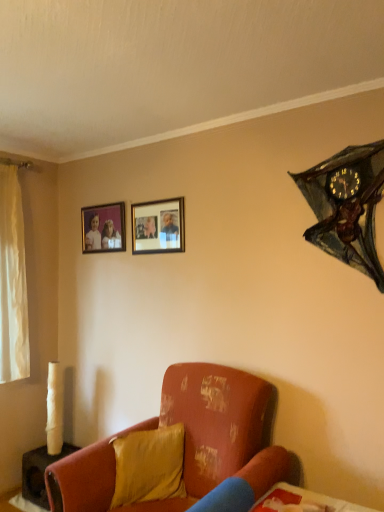
Question: From the image's perspective, does satin yellow pillow at lower center appear higher than matte wooden picture frame at upper left, the second picture frame positioned from the front?

Choices:
 (A) yes
 (B) no

Answer: (B)

Question: From the image's perspective, is satin yellow pillow at lower center under matte wooden picture frame at upper left, positioned as the 1th picture frame in left-to-right order?

Choices:
 (A) no
 (B) yes

Answer: (B)

Question: Is satin yellow pillow at lower center located outside matte wooden picture frame at upper left, which appears as the first picture frame when viewed from the back?

Choices:
 (A) yes
 (B) no

Answer: (A)

Question: Considering the relative positions of satin yellow pillow at lower center and matte wooden picture frame at upper left, which appears as the first picture frame when viewed from the back, in the image provided, is satin yellow pillow at lower center in front of matte wooden picture frame at upper left, which appears as the first picture frame when viewed from the back,?

Choices:
 (A) yes
 (B) no

Answer: (A)

Question: Is satin yellow pillow at lower center facing towards matte wooden picture frame at upper left, which appears as the first picture frame when viewed from the back?

Choices:
 (A) no
 (B) yes

Answer: (A)

Question: From a real-world perspective, is matte wooden picture frame at upper left, positioned as the 1th picture frame in left-to-right order, above or below metallic bat-shaped clock at upper right?

Choices:
 (A) below
 (B) above

Answer: (B)

Question: Is matte wooden picture frame at upper left, which appears as the first picture frame when viewed from the back, wider or thinner than metallic bat-shaped clock at upper right?

Choices:
 (A) thin
 (B) wide

Answer: (A)

Question: Is matte wooden picture frame at upper left, which is the second picture frame from right to left, taller or shorter than metallic bat-shaped clock at upper right?

Choices:
 (A) tall
 (B) short

Answer: (B)

Question: Do you think matte wooden picture frame at upper left, which appears as the first picture frame when viewed from the back, is within metallic bat-shaped clock at upper right, or outside of it?

Choices:
 (A) inside
 (B) outside

Answer: (B)

Question: Is point (339, 245) positioned closer to the camera than point (81, 222)?

Choices:
 (A) farther
 (B) closer

Answer: (B)

Question: Choose the correct answer: Is metallic bat-shaped clock at upper right inside matte wooden picture frame at upper left, which appears as the first picture frame when viewed from the back, or outside it?

Choices:
 (A) inside
 (B) outside

Answer: (B)

Question: From the image's perspective, is metallic bat-shaped clock at upper right positioned above or below matte wooden picture frame at upper left, which is the second picture frame from right to left?

Choices:
 (A) below
 (B) above

Answer: (A)

Question: In terms of size, does metallic bat-shaped clock at upper right appear bigger or smaller than matte wooden picture frame at upper left, which appears as the first picture frame when viewed from the back?

Choices:
 (A) small
 (B) big

Answer: (B)

Question: Considering the positions of matte wooden picture frame at upper left, the second picture frame positioned from the front, and matte black picture frame at upper center, the first picture frame when ordered from right to left, in the image, is matte wooden picture frame at upper left, the second picture frame positioned from the front, taller or shorter than matte black picture frame at upper center, the first picture frame when ordered from right to left,?

Choices:
 (A) tall
 (B) short

Answer: (B)

Question: Looking at their shapes, would you say matte wooden picture frame at upper left, the second picture frame positioned from the front, is wider or thinner than matte black picture frame at upper center, acting as the 1th picture frame starting from the front?

Choices:
 (A) wide
 (B) thin

Answer: (A)